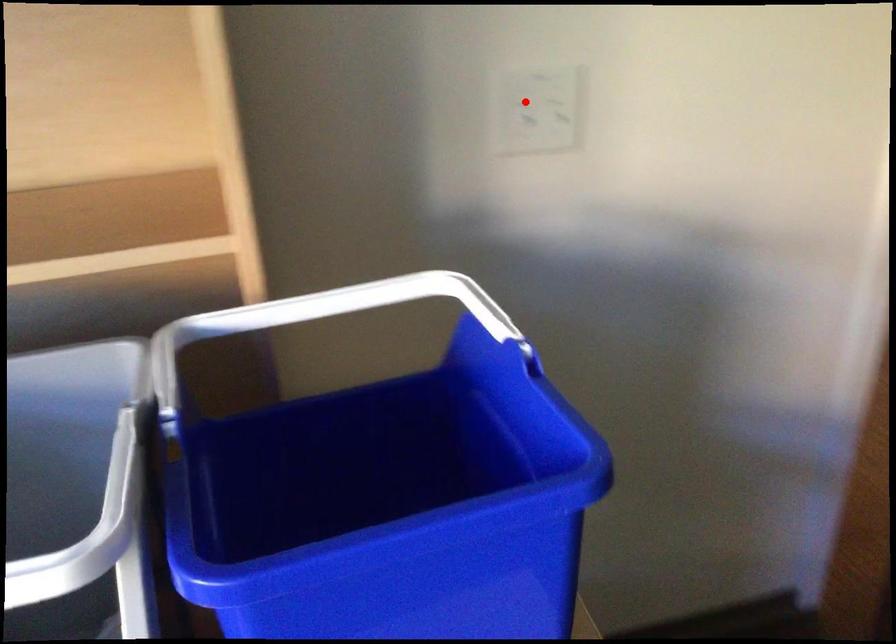
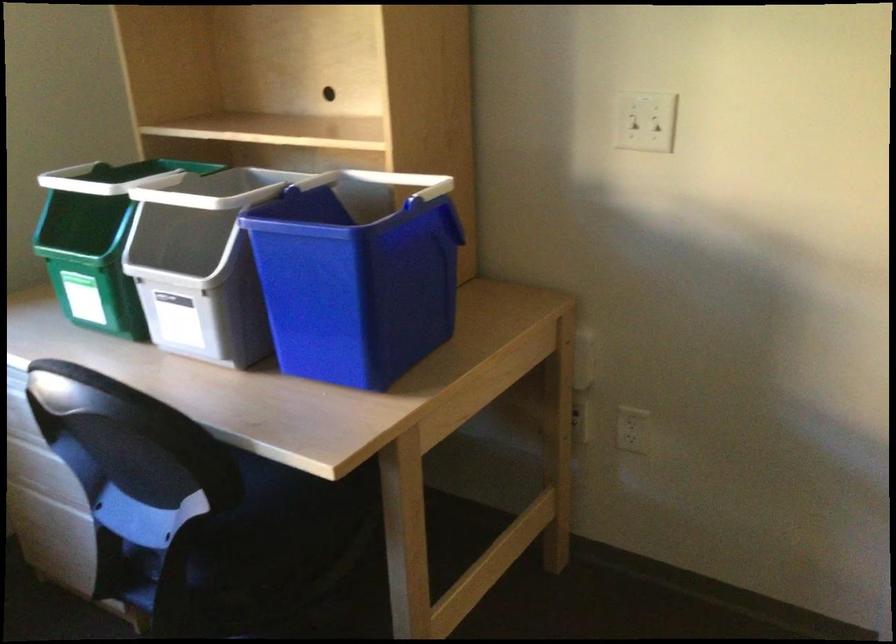
Question: A red point is marked in image1. In image2, is the corresponding 3D point closer to the camera or farther? Reply with the corresponding letter.

Choices:
 (A) The corresponding 3D point is closer.
 (B) The corresponding 3D point is farther.

Answer: (B)